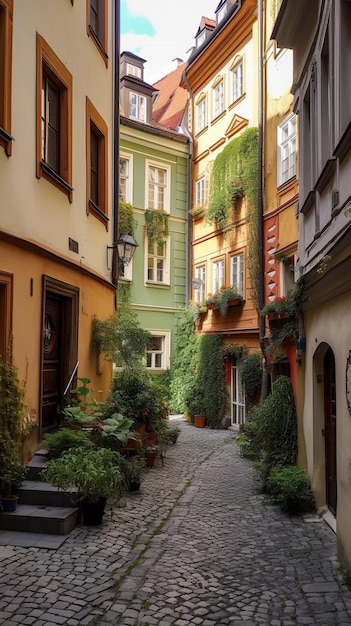
Locate an element on the screen. The width and height of the screenshot is (351, 626). handrail is located at coordinates (79, 376).